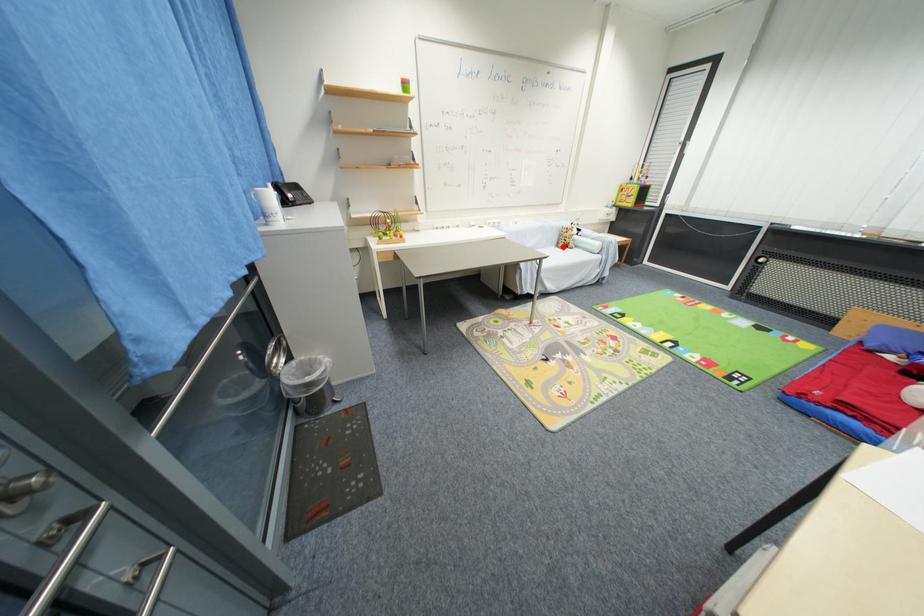
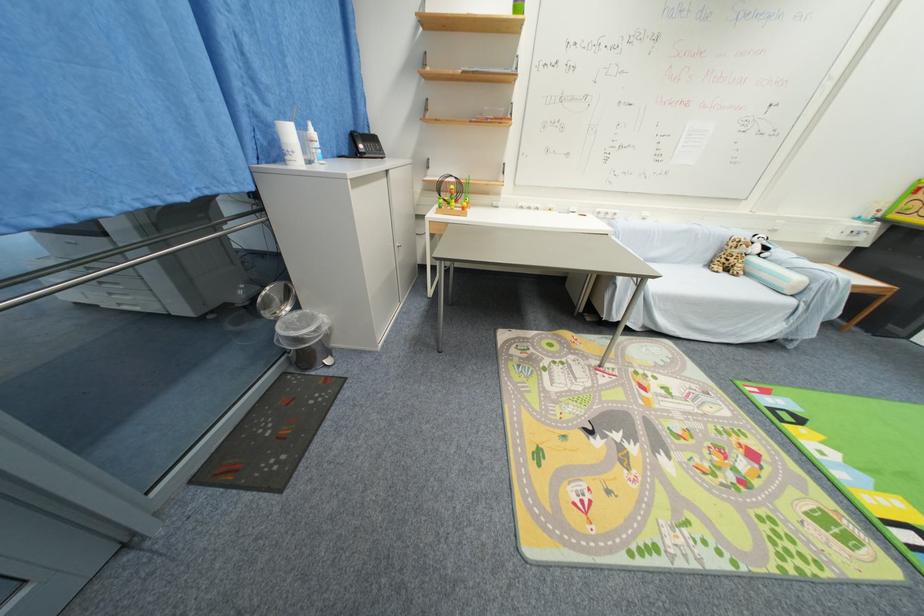
Find the pixel in the second image that matches the highlighted location in the first image.

(714, 265)